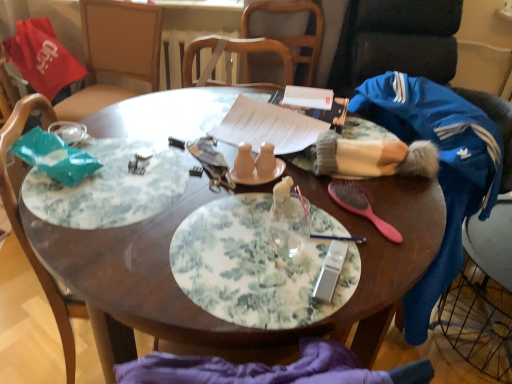
This screenshot has width=512, height=384. I want to click on vacant space situated above floral-patterned plate at center (from a real-world perspective), so click(x=266, y=246).